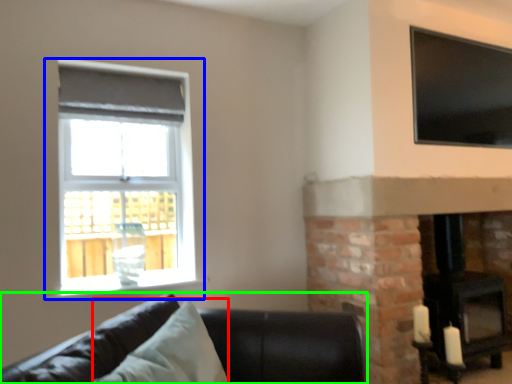
Question: Which is farther away from pillow (highlighted by a red box)? window (highlighted by a blue box) or studio couch (highlighted by a green box)?

Choices:
 (A) window
 (B) studio couch

Answer: (A)